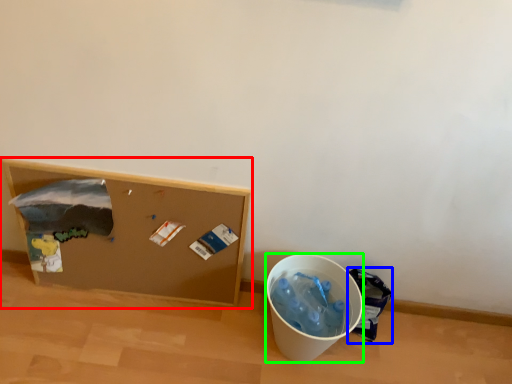
Question: Based on their relative distances, which object is nearer to furniture (highlighted by a red box)? Choose from garbage (highlighted by a blue box) and recycling bin (highlighted by a green box).

Choices:
 (A) garbage
 (B) recycling bin

Answer: (B)